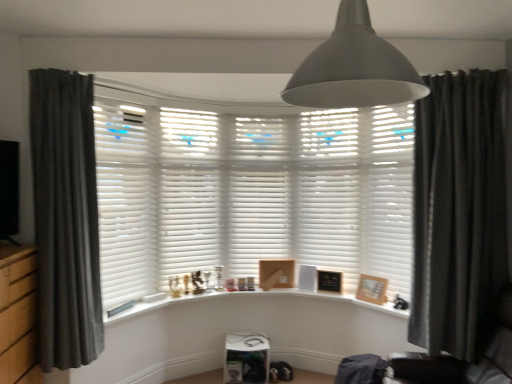
Question: Considering their positions, is dark grey fabric curtain at left, which appears as the first curtain when viewed from the left, located in front of or behind white matte shutter at center, which is the 4th shutter from left to right?

Choices:
 (A) behind
 (B) front

Answer: (B)

Question: Considering the positions of point (80, 187) and point (322, 188), is point (80, 187) closer or farther from the camera than point (322, 188)?

Choices:
 (A) closer
 (B) farther

Answer: (A)

Question: Which object is the closest to the dark grey velvet curtain at right, which is counted as the 2th curtain, starting from the left?

Choices:
 (A) white matte shutter at center, which appears as the 3th shutter when viewed from the left
 (B) white matte shutter at left, the fifth shutter viewed from the right
 (C) black leather swivel chair at lower right
 (D) white matte shutter at center, which is the 1th shutter from right to left
 (E) wooden picture frame at center, which is the first picture frame in back-to-front order

Answer: (D)

Question: Which object is the farthest from the white matte shutter at left, the fifth shutter viewed from the right?

Choices:
 (A) matte gray lampshade at upper center
 (B) white matte shutter at center, the 2th shutter from the left
 (C) black leather swivel chair at lower right
 (D) white wood window sill at center
 (E) wooden picture frame at right, which is the 1th picture frame in right-to-left order

Answer: (A)